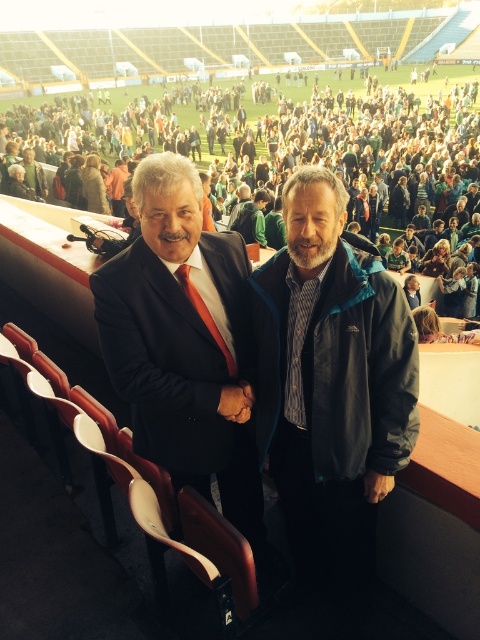
In the scene shown: Is dark blue suit at center to the left of green fabric jacket at center from the viewer's perspective?

Correct, you'll find dark blue suit at center to the left of green fabric jacket at center.

Who is more distant from viewer, [189,464] or [262,214]?

The point [262,214] is more distant.

Identify the location of dark blue suit at center. (183, 344).

Is point (275, 285) more distant than point (243, 218)?

No, (275, 285) is closer to viewer.

Between dark gray jacket at center and green fabric jacket at center, which one has less height?

green fabric jacket at center

Is point (288, 512) positioned behind point (251, 227)?

No, it is in front of (251, 227).

At what (x,y) coordinates should I click in order to perform the action: click on dark gray jacket at center. Please return your answer as a coordinate pair (x, y). Image resolution: width=480 pixels, height=640 pixels. Looking at the image, I should click on (332, 381).

Where is `dark gray jacket at center`? The width and height of the screenshot is (480, 640). dark gray jacket at center is located at coordinates (332, 381).

At what (x,y) coordinates should I click in order to perform the action: click on dark gray jacket at center. Please return your answer as a coordinate pair (x, y). Looking at the image, I should click on (332, 381).